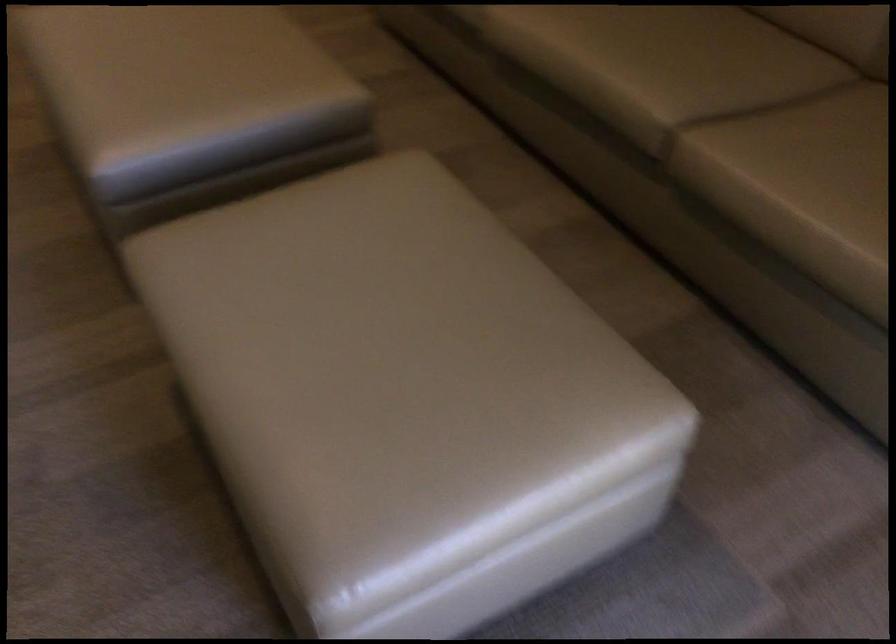
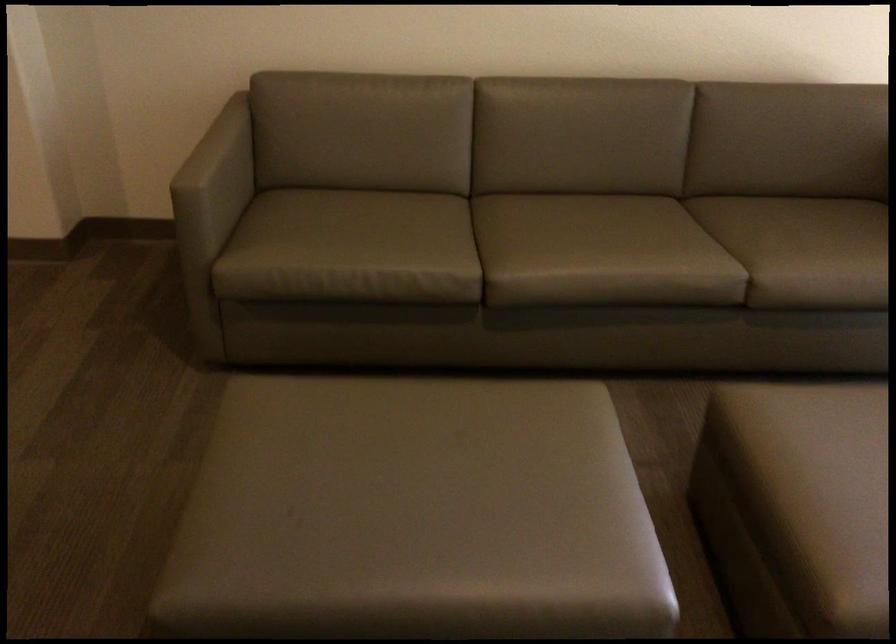
The point at (x=824, y=184) is marked in the first image. Where is the corresponding point in the second image?

(819, 251)